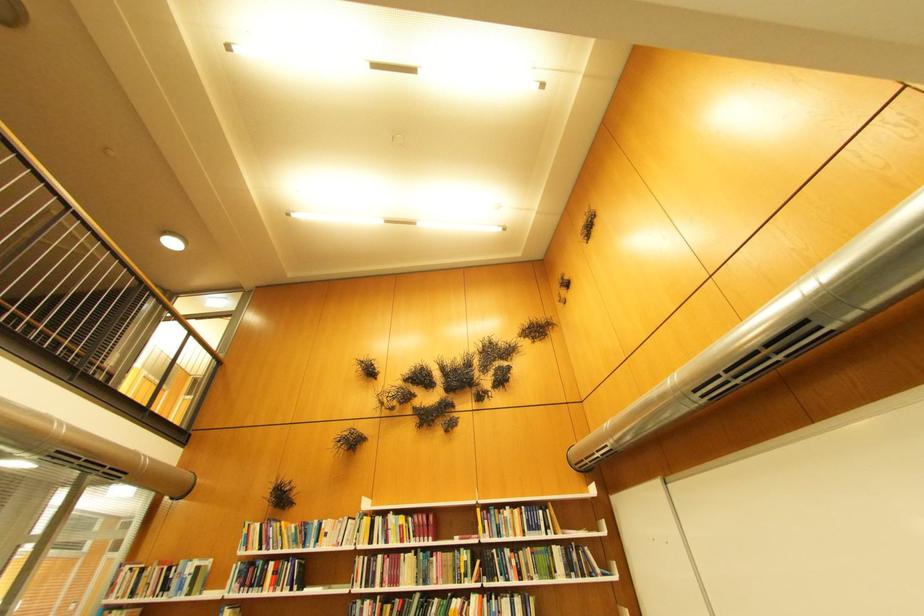
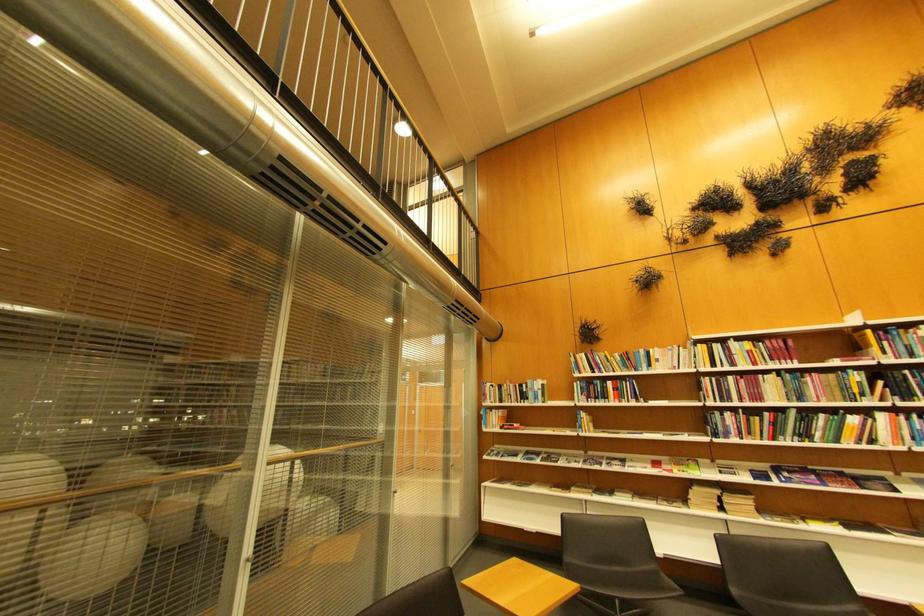
In the second image, find the point that corresponds to [323,541] in the first image.

(654, 368)